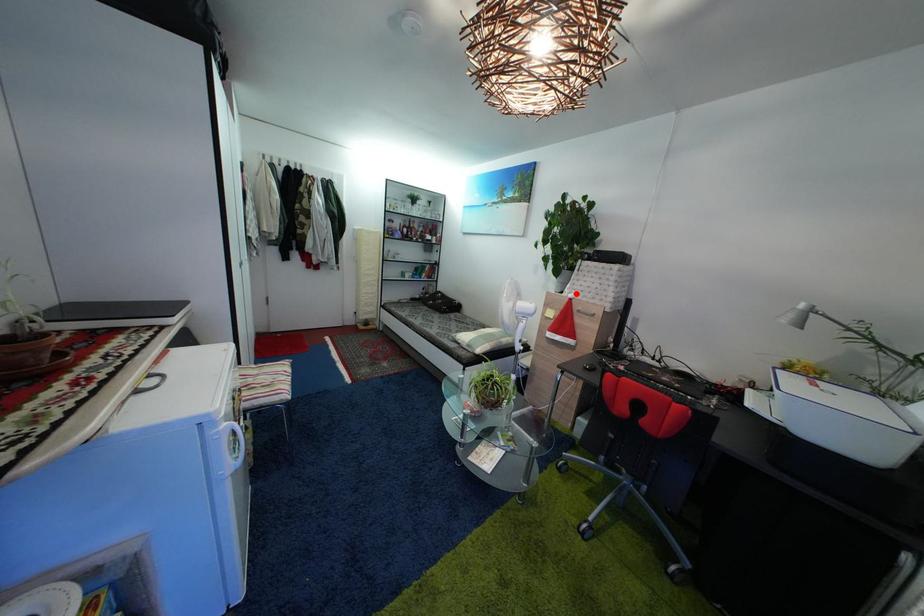
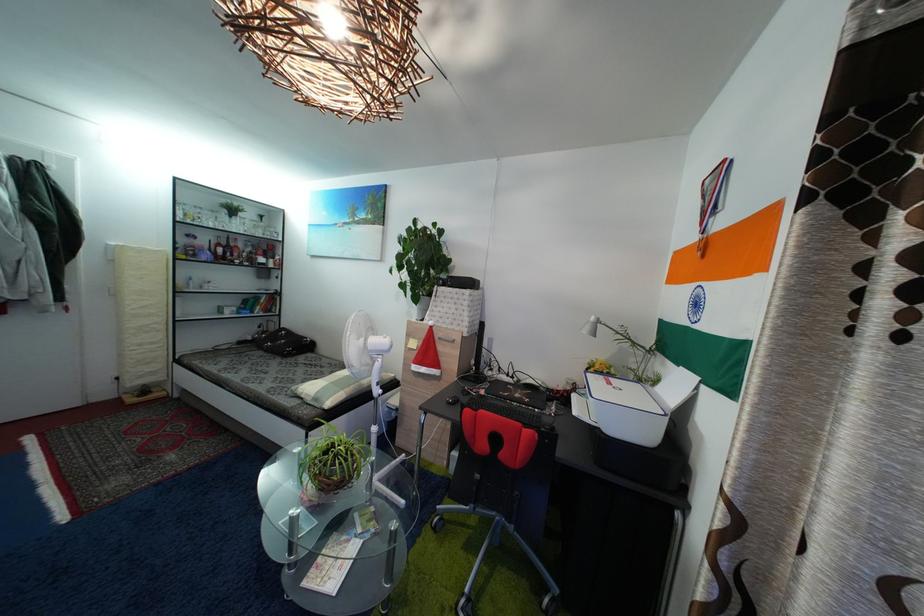
Find the pixel in the second image that matches the highlighted location in the first image.

(435, 321)